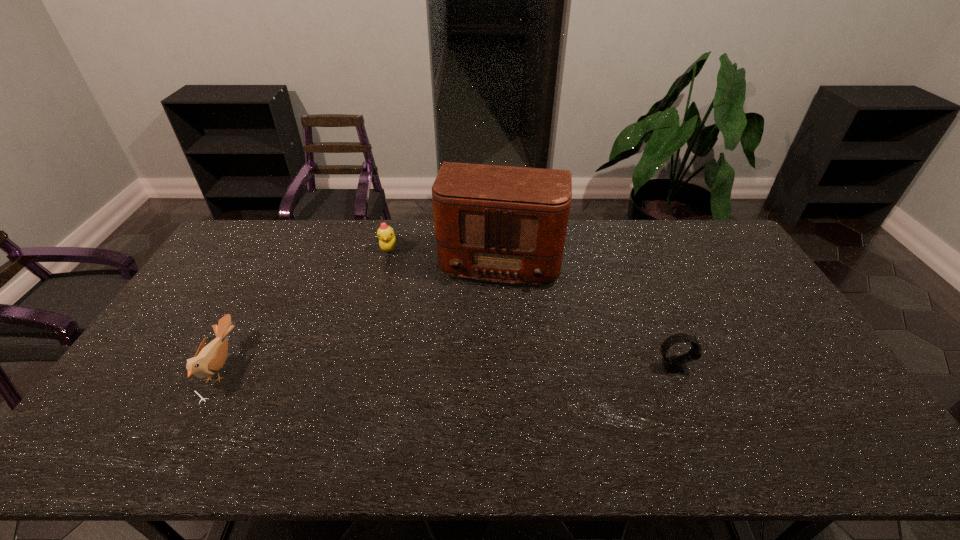
In the image, there is a desktop. Identify the location of free region at the right edge. (778, 384).

In the image, there is a desktop. Identify the location of vacant region at the near left corner. (166, 413).

Identify the location of vacant space at the far right corner of the desktop. pos(715,240).

The image size is (960, 540). I want to click on vacant space that's between the bird and the watch, so click(447, 367).

Find the location of a particular element. The height and width of the screenshot is (540, 960). empty location between the second object from right to left and the watch is located at coordinates (587, 310).

This screenshot has height=540, width=960. Identify the location of empty space that is in between the bird and the rightmost object. (447, 367).

At what (x,y) coordinates should I click in order to perform the action: click on vacant area that lies between the watch and the second object from left to right. Please return your answer as a coordinate pair (x, y). The width and height of the screenshot is (960, 540). Looking at the image, I should click on (531, 307).

Image resolution: width=960 pixels, height=540 pixels. In order to click on vacant space that's between the duckling and the rightmost object in this screenshot , I will do `click(531, 307)`.

You are a GUI agent. You are given a task and a screenshot of the screen. Output one action in this format:
    pyautogui.click(x=<x>, y=<y>)
    Task: Click on the free area in between the third object from right to left and the leftmost object
    The width and height of the screenshot is (960, 540).
    Given the screenshot: What is the action you would take?
    pyautogui.click(x=305, y=308)

Identify the location of vacant region between the leftmost object and the watch. The height and width of the screenshot is (540, 960). (447, 367).